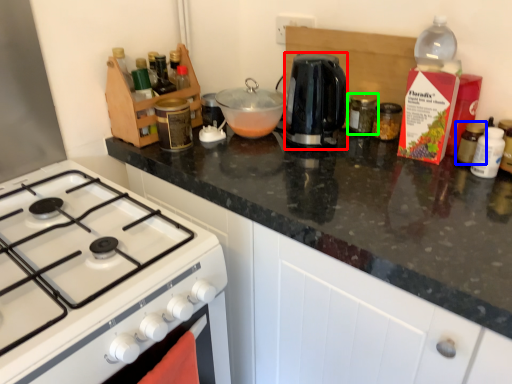
Question: Which object is the farthest from kitchen appliance (highlighted by a red box)? Choose among these: kitchen appliance (highlighted by a blue box) or kitchen appliance (highlighted by a green box).

Choices:
 (A) kitchen appliance
 (B) kitchen appliance

Answer: (A)